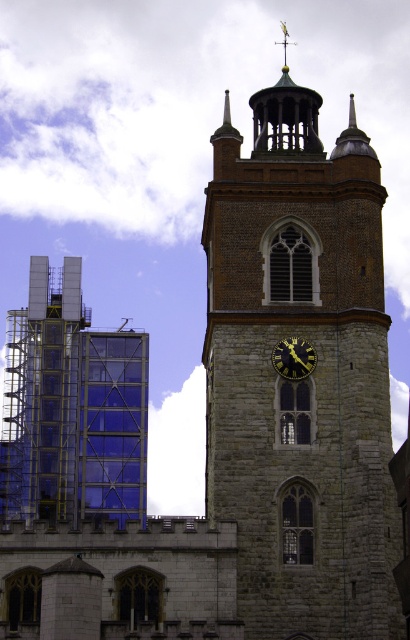
Question: Which point is farther from the camera taking this photo?

Choices:
 (A) (82, 429)
 (B) (280, 348)
 (C) (229, 509)

Answer: (A)

Question: Can you confirm if stone clock tower at center is positioned to the left of transparent glass building at left?

Choices:
 (A) no
 (B) yes

Answer: (A)

Question: Which object is the closest to the gold metallic clock at center?

Choices:
 (A) transparent glass building at left
 (B) stone clock tower at center

Answer: (B)

Question: Among these objects, which one is farthest from the camera?

Choices:
 (A) gold metallic clock at center
 (B) transparent glass building at left
 (C) stone clock tower at center

Answer: (B)

Question: Is stone clock tower at center to the right of gold metallic clock at center from the viewer's perspective?

Choices:
 (A) no
 (B) yes

Answer: (B)

Question: Is transparent glass building at left thinner than gold metallic clock at center?

Choices:
 (A) yes
 (B) no

Answer: (B)